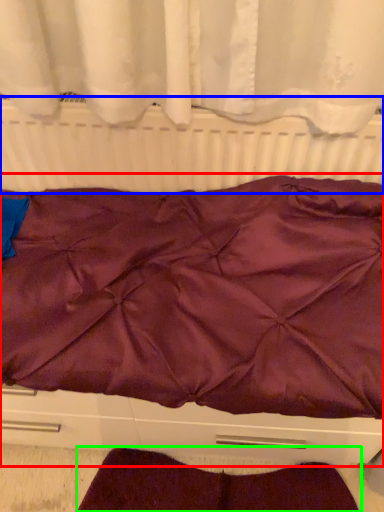
Question: Which is nearer to the furniture (highlighted by a red box)? radiator (highlighted by a blue box) or blanket (highlighted by a green box).

Choices:
 (A) radiator
 (B) blanket

Answer: (A)